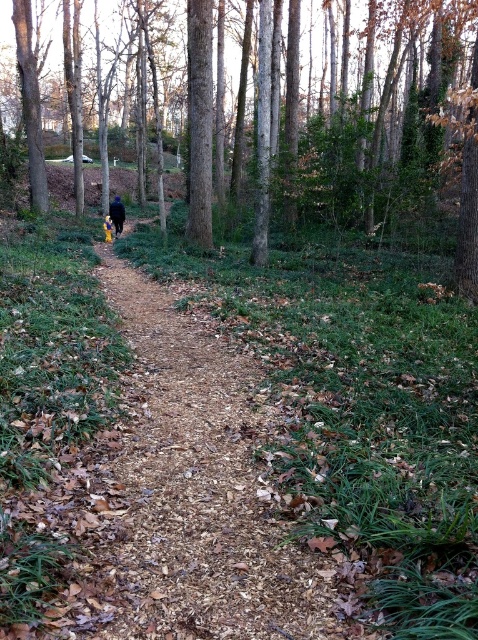
Question: Which of the following is the closest to the observer?

Choices:
 (A) (121, 218)
 (B) (41, 122)

Answer: (A)

Question: Which point is closer to the camera taking this photo?

Choices:
 (A) pyautogui.click(x=292, y=148)
 (B) pyautogui.click(x=122, y=218)

Answer: (A)

Question: Does brown smooth tree at center appear under yellow fabric at center?

Choices:
 (A) yes
 (B) no

Answer: (B)

Question: Which point is closer to the camera?

Choices:
 (A) brown smooth tree at center
 (B) yellow fabric at center

Answer: (A)

Question: Is brown smooth tree at center thinner than yellow fabric at center?

Choices:
 (A) no
 (B) yes

Answer: (A)

Question: Can you confirm if brown smooth tree at center is wider than yellow fabric at center?

Choices:
 (A) yes
 (B) no

Answer: (A)